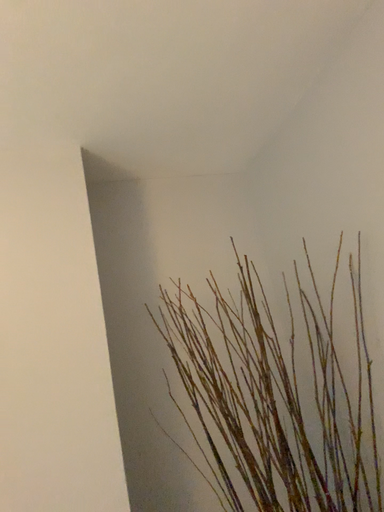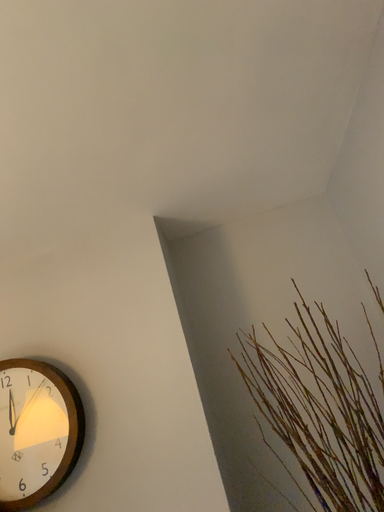
Question: How did the camera likely rotate when shooting the video?

Choices:
 (A) rotated left
 (B) rotated right

Answer: (A)